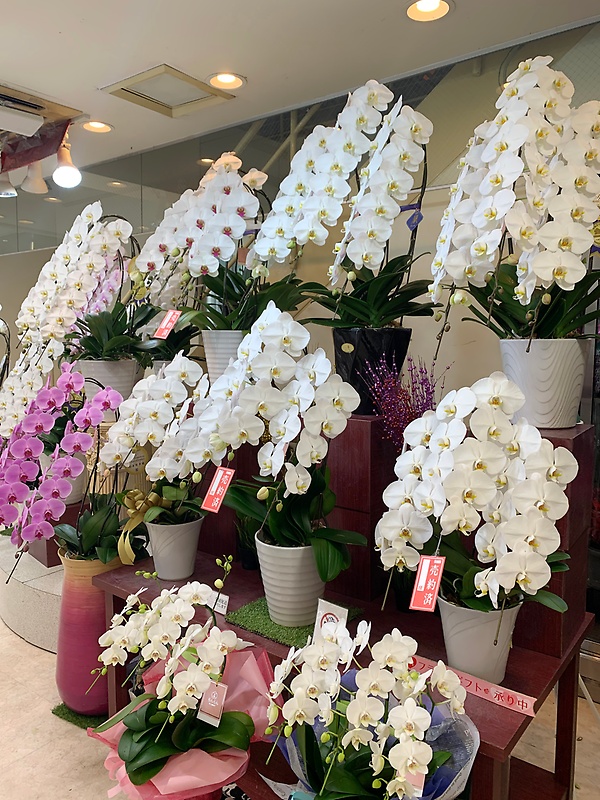
You are a GUI agent. You are given a task and a screenshot of the screen. Output one action in this format:
    pyautogui.click(x=<x>, y=<y>)
    Task: Click on the wall
    Image resolution: width=600 pixels, height=800 pixels.
    Given the screenshot: What is the action you would take?
    pyautogui.click(x=439, y=160)